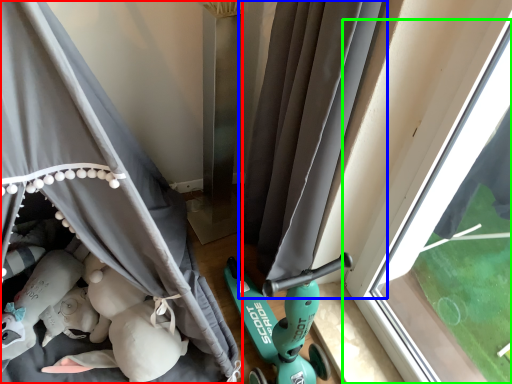
Question: Which is farther away from curtain (highlighted by a red box)? curtain (highlighted by a blue box) or window (highlighted by a green box)?

Choices:
 (A) curtain
 (B) window

Answer: (B)